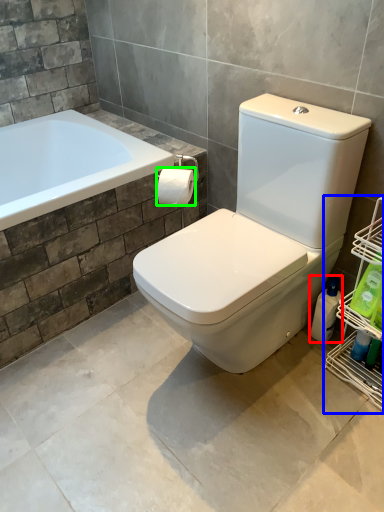
Question: Which object is the farthest from cleaning product (highlighted by a red box)? Choose among these: shelf (highlighted by a blue box) or toilet paper (highlighted by a green box).

Choices:
 (A) shelf
 (B) toilet paper

Answer: (B)